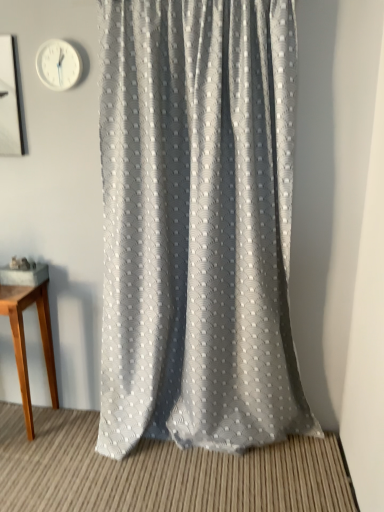
This screenshot has height=512, width=384. I want to click on free spot below textured gray curtain at center (from a real-world perspective), so click(222, 455).